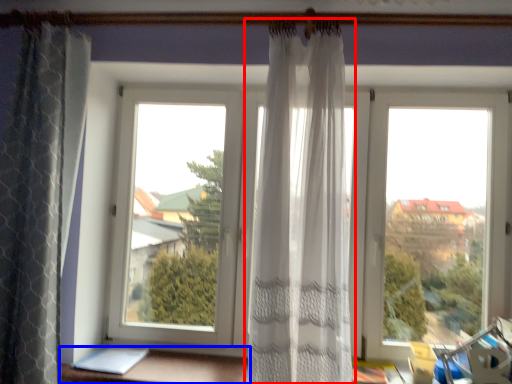
Question: Which object appears closest to the camera in this image, curtain (highlighted by a red box) or furniture (highlighted by a blue box)?

Choices:
 (A) curtain
 (B) furniture

Answer: (A)